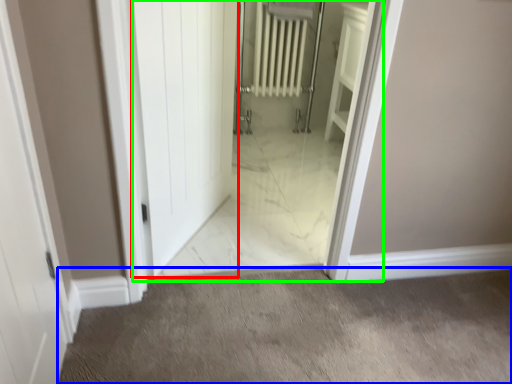
Question: Considering the real-world distances, which object is farthest from door (highlighted by a red box)? granite (highlighted by a blue box) or elevator (highlighted by a green box)?

Choices:
 (A) granite
 (B) elevator

Answer: (A)